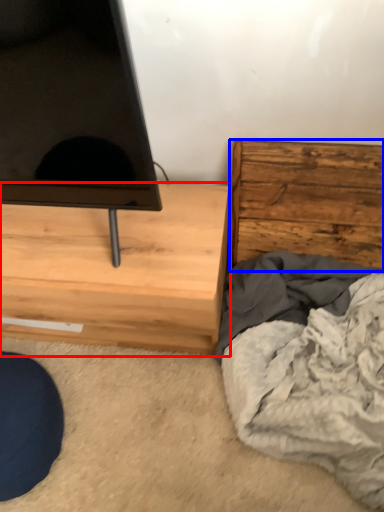
Question: Which object is closer to the camera taking this photo, chest of drawers (highlighted by a red box) or chest of drawers (highlighted by a blue box)?

Choices:
 (A) chest of drawers
 (B) chest of drawers

Answer: (A)